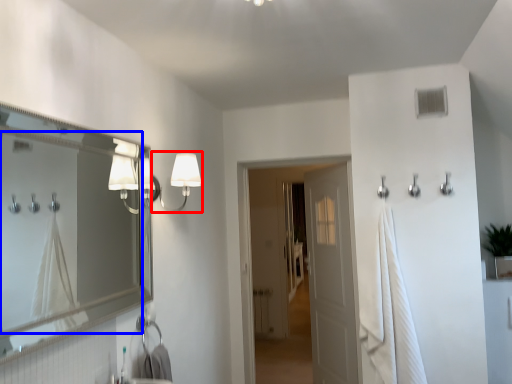
Question: Which object is closer to the camera taking this photo, fixture (highlighted by a red box) or mirror (highlighted by a blue box)?

Choices:
 (A) fixture
 (B) mirror

Answer: (B)